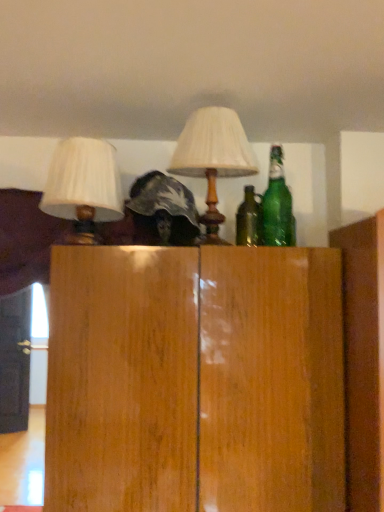
The height and width of the screenshot is (512, 384). I want to click on white fabric lampshade at upper left, the 2th lamp from the right, so click(83, 187).

What is the approximate height of green glass bottle at upper right?

14.00 inches.

Find the location of a particular element. The height and width of the screenshot is (512, 384). white fabric lampshade at upper left, the 2th lamp from the right is located at coordinates (83, 187).

What's the angular difference between wooden door at left and green glass bottle at upper right's facing directions?

There is a 25.3-degree angle between the facing directions of wooden door at left and green glass bottle at upper right.

From a real-world perspective, is wooden door at left located beneath green glass bottle at upper right?

Correct, in the physical world, wooden door at left is lower than green glass bottle at upper right.

Considering the positions of objects wooden door at left and green glass bottle at upper right in the image provided, who is behind, wooden door at left or green glass bottle at upper right?

wooden door at left is further away from the camera.

Is wooden door at left to the right of green glass bottle at upper right from the viewer's perspective?

No.

Is green glass bottle at upper right taller than white fabric lampshade at upper left, the 2th lamp from the right?

Yes.

Measure the distance from green glass bottle at upper right to white fabric lampshade at upper left, the 2th lamp from the right.

green glass bottle at upper right and white fabric lampshade at upper left, the 2th lamp from the right, are 24.14 inches apart.

Is green glass bottle at upper right looking in the opposite direction of white fabric lampshade at upper left, which ranks as the 1th lamp in left-to-right order?

That's not correct — green glass bottle at upper right is not looking away from white fabric lampshade at upper left, which ranks as the 1th lamp in left-to-right order.

Considering the positions of point (282, 193) and point (96, 144), is point (282, 193) closer or farther from the camera than point (96, 144)?

Point (282, 193) is positioned farther from the camera compared to point (96, 144).

From a real-world perspective, relative to matte white lampshade at center, which appears as the 2th lamp when viewed from the left, is green glass bottle at upper right vertically above or below?

green glass bottle at upper right is below matte white lampshade at center, which appears as the 2th lamp when viewed from the left.

Does green glass bottle at upper right have a smaller size compared to matte white lampshade at center, the 1th lamp when ordered from right to left?

Indeed, green glass bottle at upper right has a smaller size compared to matte white lampshade at center, the 1th lamp when ordered from right to left.

In the scene shown: Considering the relative sizes of green glass bottle at upper right and matte white lampshade at center, which appears as the 2th lamp when viewed from the left, in the image provided, is green glass bottle at upper right taller than matte white lampshade at center, which appears as the 2th lamp when viewed from the left,?

No.

Considering the relative positions of green glass bottle at upper right and matte white lampshade at center, which appears as the 2th lamp when viewed from the left, in the image provided, is green glass bottle at upper right to the left or to the right of matte white lampshade at center, which appears as the 2th lamp when viewed from the left,?

Based on their positions, green glass bottle at upper right is located to the right of matte white lampshade at center, which appears as the 2th lamp when viewed from the left.

Based on the photo, is white fabric lampshade at upper left, which ranks as the 1th lamp in left-to-right order, in front of or behind wooden door at left in the image?

Visually, white fabric lampshade at upper left, which ranks as the 1th lamp in left-to-right order, is located in front of wooden door at left.

Is wooden door at left surrounded by white fabric lampshade at upper left, which ranks as the 1th lamp in left-to-right order?

No, wooden door at left is not surrounded by white fabric lampshade at upper left, which ranks as the 1th lamp in left-to-right order.

Considering the sizes of white fabric lampshade at upper left, which ranks as the 1th lamp in left-to-right order, and wooden door at left in the image, is white fabric lampshade at upper left, which ranks as the 1th lamp in left-to-right order, wider or thinner than wooden door at left?

In the image, white fabric lampshade at upper left, which ranks as the 1th lamp in left-to-right order, appears to be wider than wooden door at left.

Is white fabric lampshade at upper left, the 2th lamp from the right, looking in the opposite direction of wooden door at left?

No.

Find the location of a particular element. The image size is (384, 512). lamp to the right of white fabric lampshade at upper left, which ranks as the 1th lamp in left-to-right order is located at coordinates (213, 158).

Would you say matte white lampshade at center, the 1th lamp when ordered from right to left, is part of white fabric lampshade at upper left, the 2th lamp from the right,'s contents?

No, matte white lampshade at center, the 1th lamp when ordered from right to left, is not surrounded by white fabric lampshade at upper left, the 2th lamp from the right.

Does white fabric lampshade at upper left, the 2th lamp from the right, have a smaller size compared to matte white lampshade at center, the 1th lamp when ordered from right to left?

Correct, white fabric lampshade at upper left, the 2th lamp from the right, occupies less space than matte white lampshade at center, the 1th lamp when ordered from right to left.

Considering the relative sizes of white fabric lampshade at upper left, the 2th lamp from the right, and matte white lampshade at center, which appears as the 2th lamp when viewed from the left, in the image provided, is white fabric lampshade at upper left, the 2th lamp from the right, taller than matte white lampshade at center, which appears as the 2th lamp when viewed from the left,?

No.

Considering the positions of point (28, 406) and point (113, 189), is point (28, 406) closer or farther from the camera than point (113, 189)?

Point (28, 406) is farther from the camera than point (113, 189).

In the scene shown: From a real-world perspective, does wooden door at left stand above white fabric lampshade at upper left, which ranks as the 1th lamp in left-to-right order?

No, from a real-world perspective, wooden door at left is not on top of white fabric lampshade at upper left, which ranks as the 1th lamp in left-to-right order.

Is wooden door at left shorter than white fabric lampshade at upper left, the 2th lamp from the right?

In fact, wooden door at left may be taller than white fabric lampshade at upper left, the 2th lamp from the right.

How different are the orientations of wooden door at left and white fabric lampshade at upper left, which ranks as the 1th lamp in left-to-right order, in degrees?

25.3 degrees.

From the image's perspective, does wooden door at left appear higher than matte white lampshade at center, the 1th lamp when ordered from right to left?

Incorrect, from the image's perspective, wooden door at left is lower than matte white lampshade at center, the 1th lamp when ordered from right to left.

Does wooden door at left have a larger size compared to matte white lampshade at center, which appears as the 2th lamp when viewed from the left?

Indeed, wooden door at left has a larger size compared to matte white lampshade at center, which appears as the 2th lamp when viewed from the left.

Find the location of a particular element. door located on the left of matte white lampshade at center, which appears as the 2th lamp when viewed from the left is located at coordinates (15, 361).

Is wooden door at left beside matte white lampshade at center, the 1th lamp when ordered from right to left?

No, wooden door at left is not in contact with matte white lampshade at center, the 1th lamp when ordered from right to left.

Identify the location of door below the green glass bottle at upper right (from a real-world perspective). The width and height of the screenshot is (384, 512). coord(15,361).

Where is `lamp that is the 2nd object to the left of the green glass bottle at upper right, starting at the anchor`? lamp that is the 2nd object to the left of the green glass bottle at upper right, starting at the anchor is located at coordinates (83, 187).

When comparing their distances from white fabric lampshade at upper left, the 2th lamp from the right, does wooden door at left or matte white lampshade at center, which appears as the 2th lamp when viewed from the left, seem closer?

matte white lampshade at center, which appears as the 2th lamp when viewed from the left, is closer to white fabric lampshade at upper left, the 2th lamp from the right.

From the image, which object appears to be farther from white fabric lampshade at upper left, which ranks as the 1th lamp in left-to-right order, green glass bottle at upper right or wooden door at left?

wooden door at left lies further to white fabric lampshade at upper left, which ranks as the 1th lamp in left-to-right order, than the other object.

Estimate the real-world distances between objects in this image. Which object is further from matte white lampshade at center, which appears as the 2th lamp when viewed from the left, green glass bottle at upper right or white fabric lampshade at upper left, the 2th lamp from the right?

white fabric lampshade at upper left, the 2th lamp from the right, lies further to matte white lampshade at center, which appears as the 2th lamp when viewed from the left, than the other object.

From the image, which object appears to be nearer to green glass bottle at upper right, wooden door at left or white fabric lampshade at upper left, the 2th lamp from the right?

white fabric lampshade at upper left, the 2th lamp from the right, is closer to green glass bottle at upper right.

Which object lies further to the anchor point green glass bottle at upper right, white fabric lampshade at upper left, the 2th lamp from the right, or wooden door at left?

The object further to green glass bottle at upper right is wooden door at left.

From the image, which object appears to be nearer to green glass bottle at upper right, wooden door at left or matte white lampshade at center, the 1th lamp when ordered from right to left?

Based on the image, matte white lampshade at center, the 1th lamp when ordered from right to left, appears to be nearer to green glass bottle at upper right.

From the image, which object appears to be farther from wooden door at left, green glass bottle at upper right or white fabric lampshade at upper left, the 2th lamp from the right?

green glass bottle at upper right is positioned further to the anchor wooden door at left.

When comparing their distances from matte white lampshade at center, which appears as the 2th lamp when viewed from the left, does white fabric lampshade at upper left, which ranks as the 1th lamp in left-to-right order, or wooden door at left seem further?

Based on the image, wooden door at left appears to be further to matte white lampshade at center, which appears as the 2th lamp when viewed from the left.

Where is `bottle between white fabric lampshade at upper left, which ranks as the 1th lamp in left-to-right order, and wooden door at left in the front-back direction`? The image size is (384, 512). bottle between white fabric lampshade at upper left, which ranks as the 1th lamp in left-to-right order, and wooden door at left in the front-back direction is located at coordinates (277, 206).

Locate an element on the screen. The width and height of the screenshot is (384, 512). lamp located between white fabric lampshade at upper left, which ranks as the 1th lamp in left-to-right order, and green glass bottle at upper right in the left-right direction is located at coordinates (213, 158).

Find the location of a particular element. The width and height of the screenshot is (384, 512). bottle located between matte white lampshade at center, the 1th lamp when ordered from right to left, and wooden door at left in the depth direction is located at coordinates (277, 206).

This screenshot has width=384, height=512. In order to click on lamp located between white fabric lampshade at upper left, which ranks as the 1th lamp in left-to-right order, and wooden door at left in the depth direction in this screenshot , I will do `click(213, 158)`.